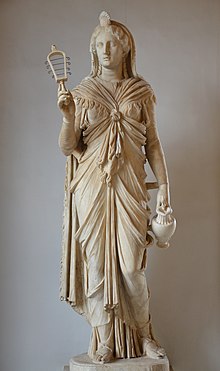
What are the coordinates of `statue` in the screenshot? It's located at (112, 207).